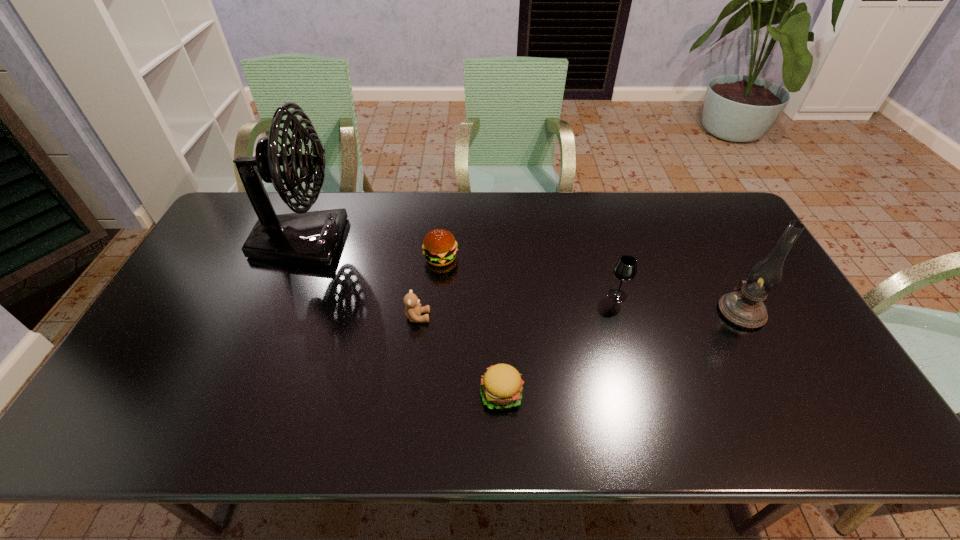
What are the coordinates of `object that is at the right edge` in the screenshot? It's located at (743, 307).

Identify the location of object that is at the far left corner. The image size is (960, 540). (312, 238).

Where is `free point at the far edge`? free point at the far edge is located at coordinates (646, 213).

The image size is (960, 540). In the image, there is a desktop. Find the location of `vacant space at the near edge`. vacant space at the near edge is located at coordinates (506, 438).

In the image, there is a desktop. Find the location of `vacant space at the left edge`. vacant space at the left edge is located at coordinates (236, 246).

You are a GUI agent. You are given a task and a screenshot of the screen. Output one action in this format:
    pyautogui.click(x=<x>, y=<y>)
    Task: Click on the vacant space at the right edge of the desktop
    This screenshot has width=960, height=540.
    Given the screenshot: What is the action you would take?
    pyautogui.click(x=776, y=336)

The height and width of the screenshot is (540, 960). Identify the location of vacant space at the far left corner. (269, 193).

Where is `vacant region at the far right corner of the desktop`? This screenshot has height=540, width=960. vacant region at the far right corner of the desktop is located at coordinates (720, 219).

You are a GUI agent. You are given a task and a screenshot of the screen. Output one action in this format:
    pyautogui.click(x=<x>, y=<y>)
    Task: Click on the free space that is in between the leftmost object and the fifth shortest object
    The width and height of the screenshot is (960, 540).
    Given the screenshot: What is the action you would take?
    pyautogui.click(x=521, y=276)

Locate an element on the screen. Image resolution: width=960 pixels, height=540 pixels. empty space between the wineglass and the fifth shortest object is located at coordinates (679, 303).